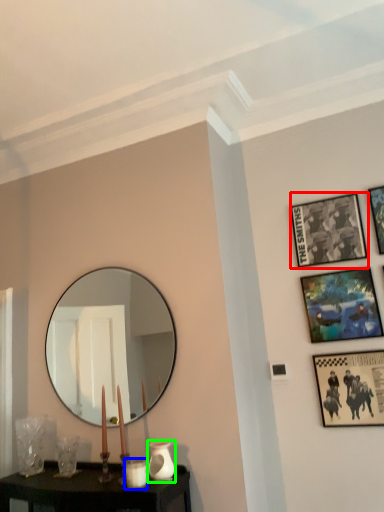
Question: Which object is positioned closest to picture frame (highlighted by a red box)? Select from candle holder (highlighted by a blue box) and vase (highlighted by a green box).

Choices:
 (A) candle holder
 (B) vase

Answer: (B)